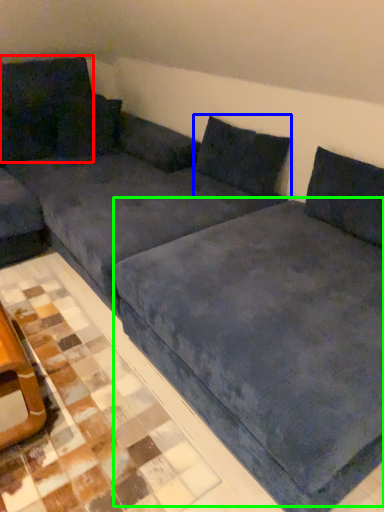
Question: Which object is positioned closest to pillow (highlighted by a red box)? Select from pillow (highlighted by a blue box) and bedding (highlighted by a green box).

Choices:
 (A) pillow
 (B) bedding

Answer: (A)